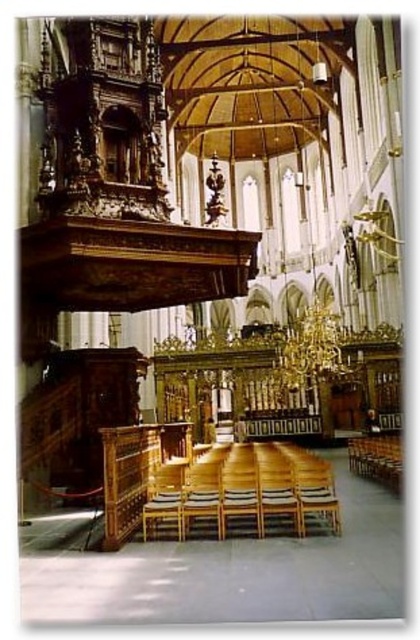
You are standing inside the grand church and want to move from the entrance to the wooden chair at lower right. There is a wooden at center in your path. Can you walk around it to reach the chair?

The wooden at center is in front of the wooden chair at lower right, so you can walk around it to reach the chair.

You are an interior designer planning to place a new rug in the church. You have a rug that is 2 meters wide. You see the wooden at center and the wooden chair at lower right. Which object can the rug fit under without overlapping its edges?

The rug can fit under the wooden at center because its width is larger than the wooden chair at lower right, so the rug would not overlap the edges of the wooden at center.